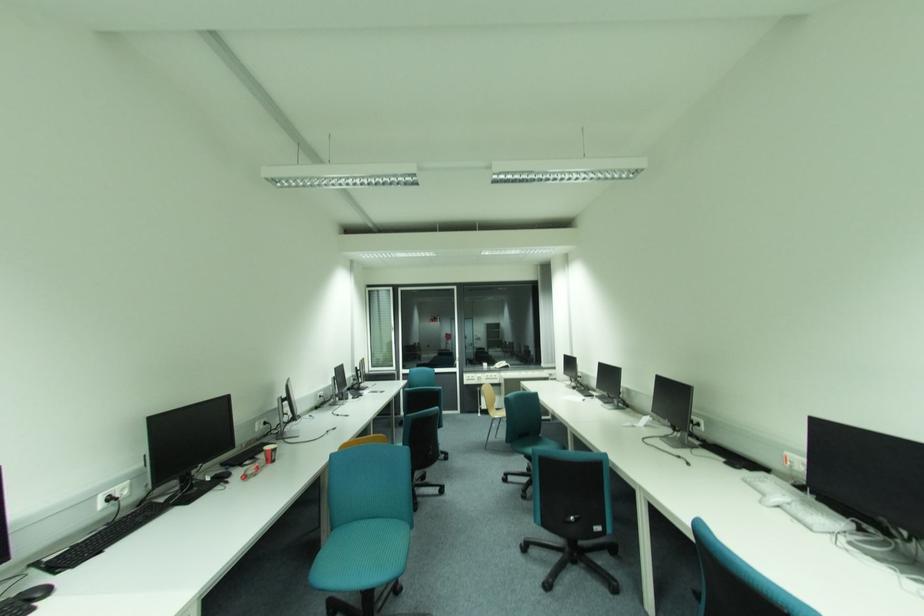
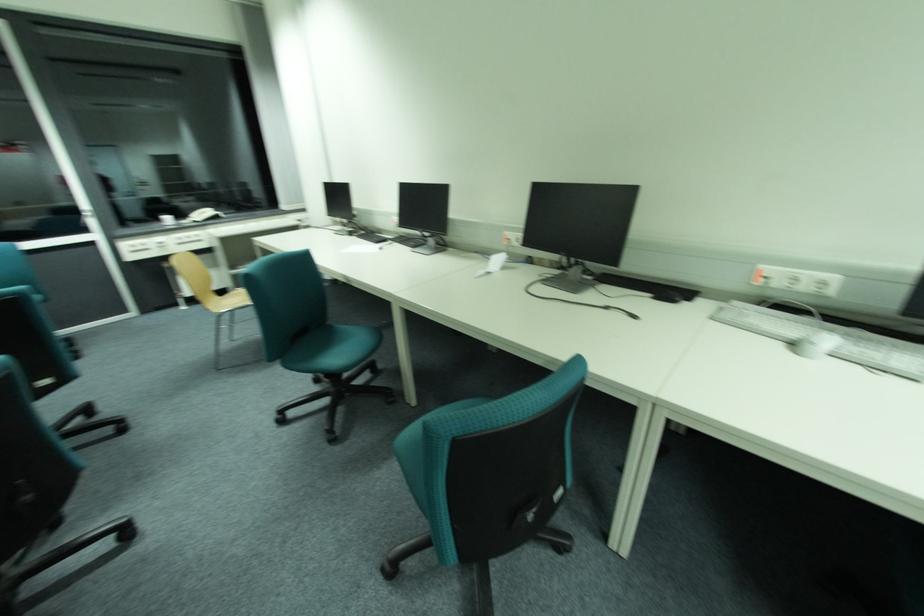
In the second image, find the point that corresponds to point 796,466 in the first image.

(772, 283)